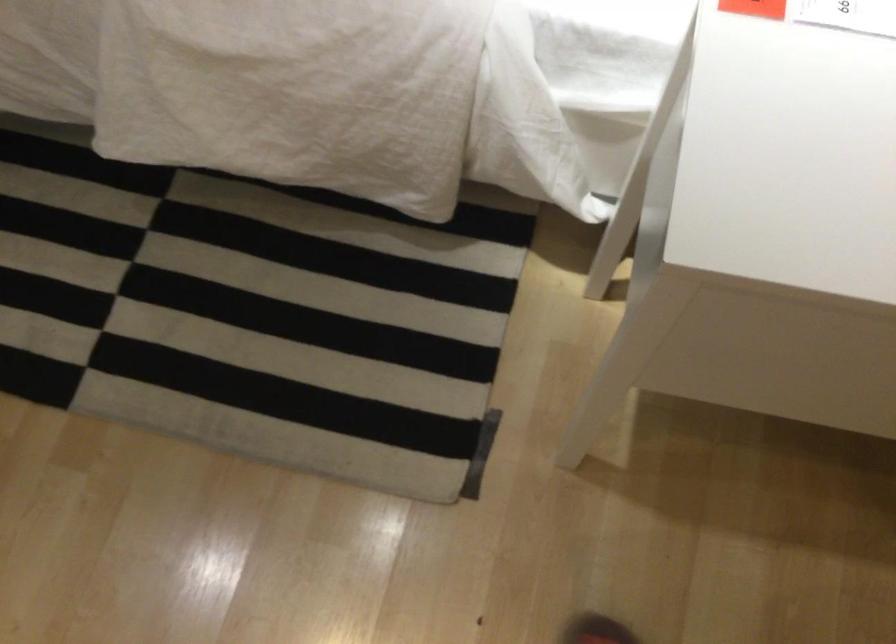
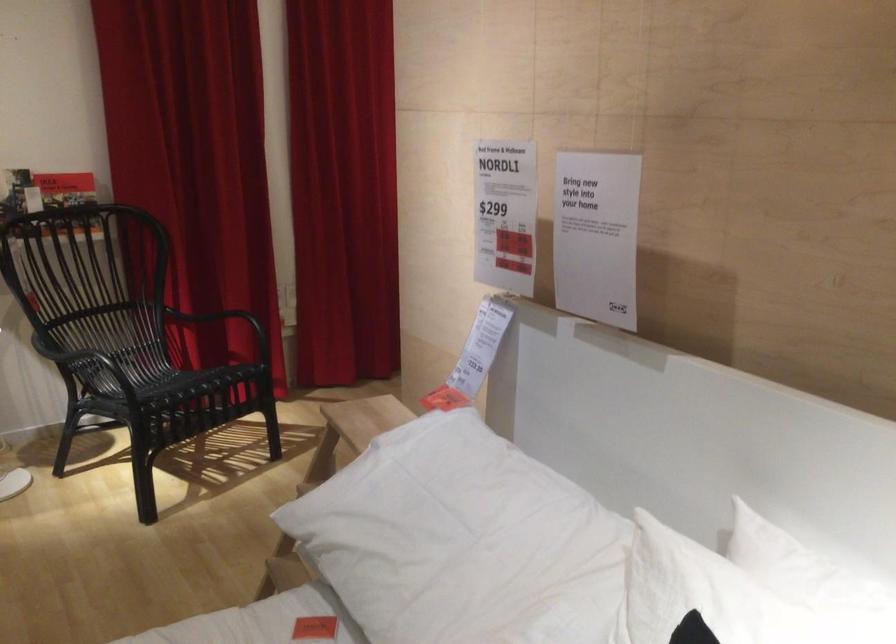
Based on the continuous images, in which direction is the camera rotating?

The camera rotated toward right-up.